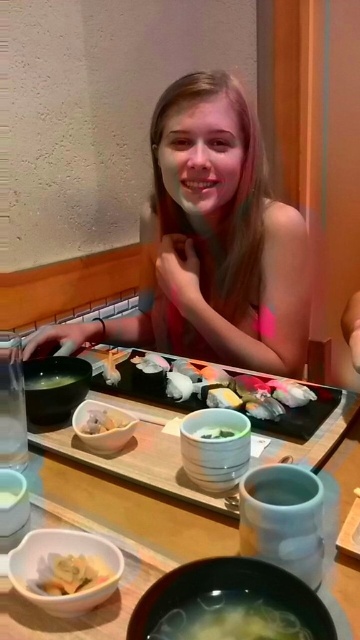
Question: Which point is farther to the camera?

Choices:
 (A) (128, 388)
 (B) (83, 618)
 (C) (52, 566)
 (D) (159, 208)

Answer: (D)

Question: Can you confirm if pink matte bikini top at center is positioned below black matte sushi platter at center?

Choices:
 (A) yes
 (B) no

Answer: (B)

Question: Which object is farther from the camera taking this photo?

Choices:
 (A) white glossy dumpling at lower left
 (B) pink matte bikini top at center

Answer: (B)

Question: Is wooden table at center below white glossy dumpling at lower left?

Choices:
 (A) yes
 (B) no

Answer: (B)

Question: Observing the image, what is the correct spatial positioning of pink matte bikini top at center in reference to clear broth at center?

Choices:
 (A) left
 (B) right

Answer: (A)

Question: Which of the following is the closest to the observer?

Choices:
 (A) wooden table at center
 (B) pink matte bikini top at center
 (C) black matte sushi platter at center

Answer: (A)